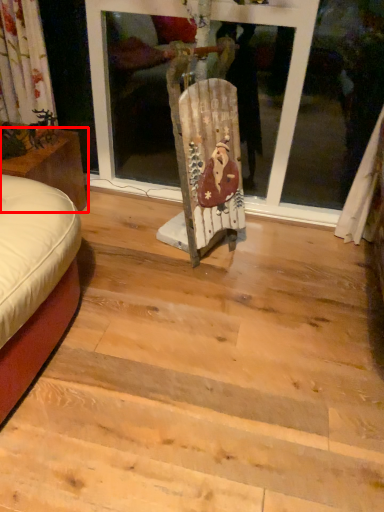
Question: From the image's perspective, where is furniture (annotated by the red box) located relative to art?

Choices:
 (A) above
 (B) below

Answer: (B)